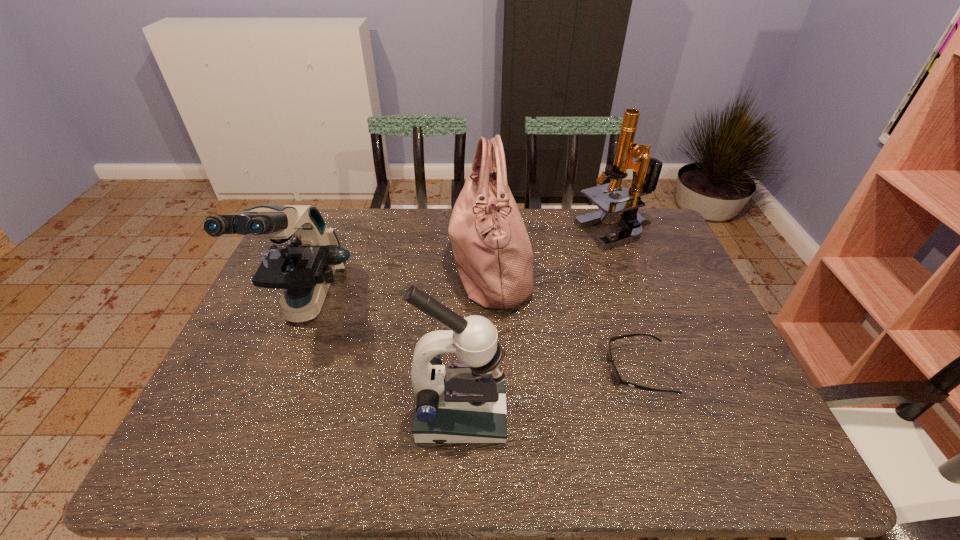
At what (x,y) coordinates should I click in order to perform the action: click on object situated at the left edge. Please return your answer as a coordinate pair (x, y). The height and width of the screenshot is (540, 960). Looking at the image, I should click on (305, 254).

Where is `object that is at the right edge`? The height and width of the screenshot is (540, 960). object that is at the right edge is located at coordinates (646, 170).

At what (x,y) coordinates should I click in order to perform the action: click on object located at the far right corner. Please return your answer as a coordinate pair (x, y). The width and height of the screenshot is (960, 540). Looking at the image, I should click on (646, 170).

The width and height of the screenshot is (960, 540). Find the location of `vacant space at the far edge of the desktop`. vacant space at the far edge of the desktop is located at coordinates (443, 222).

Where is `free point at the near edge`? This screenshot has width=960, height=540. free point at the near edge is located at coordinates (405, 457).

Image resolution: width=960 pixels, height=540 pixels. I want to click on vacant space at the right edge of the desktop, so 663,309.

The height and width of the screenshot is (540, 960). What are the coordinates of `free region at the far right corner` in the screenshot? It's located at (644, 240).

The width and height of the screenshot is (960, 540). In order to click on free space at the near right corner in this screenshot , I will do `click(710, 446)`.

The height and width of the screenshot is (540, 960). Identify the location of free space that is in between the second microscope from right to left and the sunglasses. (550, 392).

At what (x,y) coordinates should I click in order to perform the action: click on free space between the handbag and the second farthest microscope. Please return your answer as a coordinate pair (x, y). Looking at the image, I should click on (398, 284).